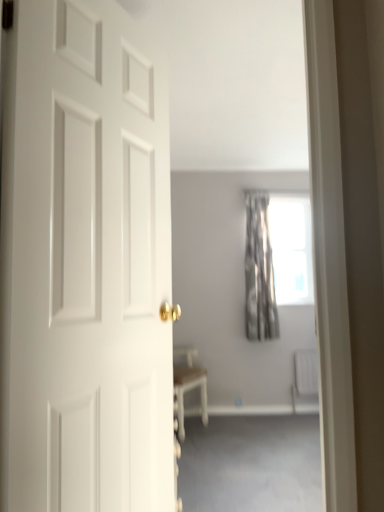
Question: Is gray fabric curtain at upper center bigger than silvery metallic curtain at center?

Choices:
 (A) yes
 (B) no

Answer: (A)

Question: Does gray fabric curtain at upper center have a greater width compared to silvery metallic curtain at center?

Choices:
 (A) yes
 (B) no

Answer: (A)

Question: From the image's perspective, is gray fabric curtain at upper center below silvery metallic curtain at center?

Choices:
 (A) yes
 (B) no

Answer: (A)

Question: Considering the relative sizes of gray fabric curtain at upper center and silvery metallic curtain at center in the image provided, is gray fabric curtain at upper center thinner than silvery metallic curtain at center?

Choices:
 (A) yes
 (B) no

Answer: (B)

Question: Is gray fabric curtain at upper center taller than silvery metallic curtain at center?

Choices:
 (A) no
 (B) yes

Answer: (A)

Question: Considering the relative positions of gray fabric curtain at upper center and silvery metallic curtain at center in the image provided, is gray fabric curtain at upper center to the right of silvery metallic curtain at center from the viewer's perspective?

Choices:
 (A) no
 (B) yes

Answer: (A)

Question: Considering the relative sizes of white matte door at left and white plastic radiator at lower right in the image provided, is white matte door at left smaller than white plastic radiator at lower right?

Choices:
 (A) no
 (B) yes

Answer: (A)

Question: Is white matte door at left closer to the viewer compared to white plastic radiator at lower right?

Choices:
 (A) yes
 (B) no

Answer: (A)

Question: Is white matte door at left far from white plastic radiator at lower right?

Choices:
 (A) yes
 (B) no

Answer: (A)

Question: Is white matte door at left to the left of white plastic radiator at lower right from the viewer's perspective?

Choices:
 (A) no
 (B) yes

Answer: (B)

Question: Is white plastic radiator at lower right located within white matte door at left?

Choices:
 (A) yes
 (B) no

Answer: (B)

Question: Does white matte door at left have a lesser height compared to white plastic radiator at lower right?

Choices:
 (A) no
 (B) yes

Answer: (A)

Question: Is white plastic radiator at lower right further to the viewer compared to white matte door at left?

Choices:
 (A) no
 (B) yes

Answer: (B)